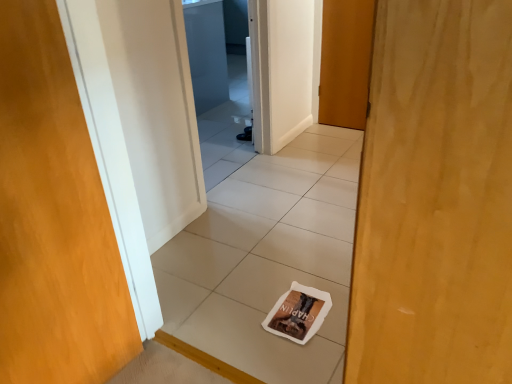
Find the location of a particular element. empty space that is ontop of white tile at center is located at coordinates (254, 243).